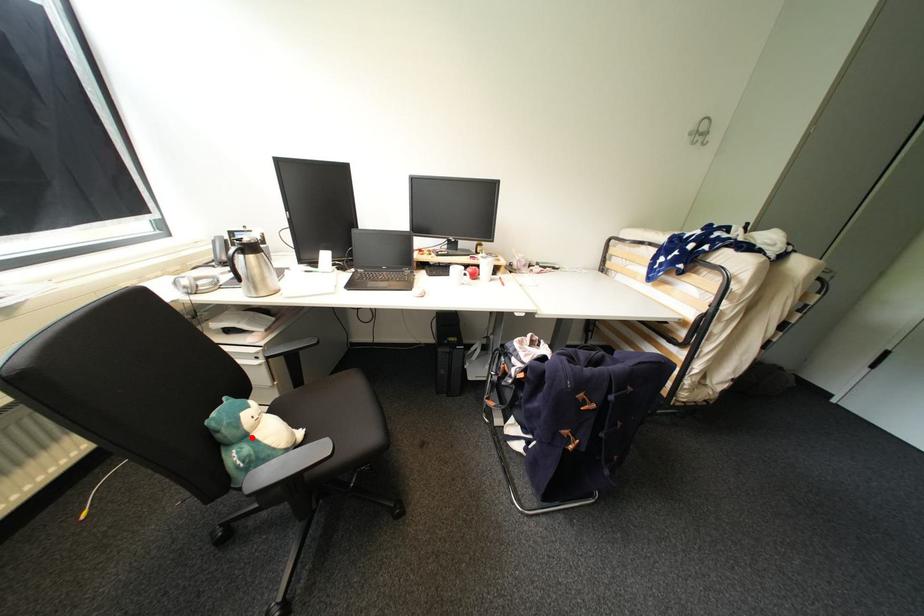
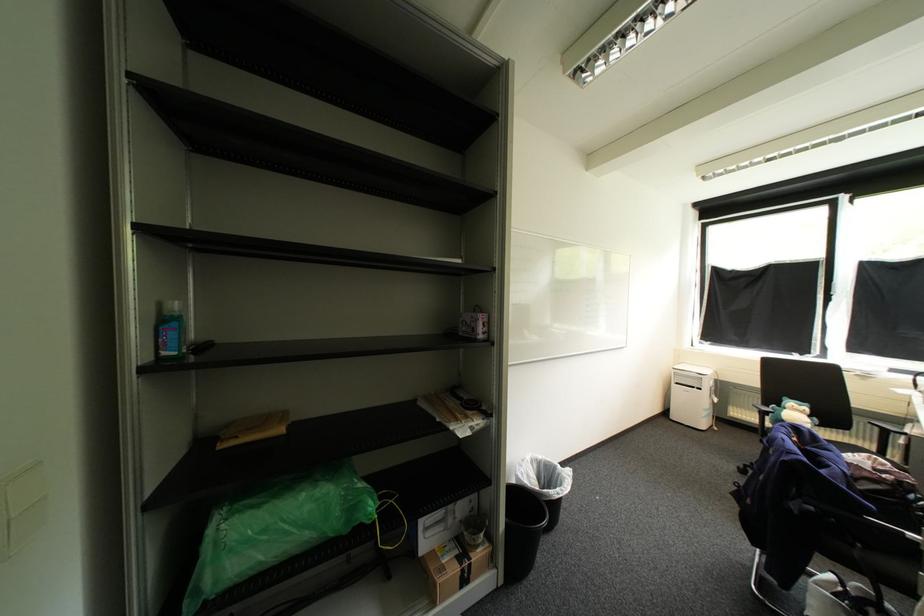
Question: I am providing you with two images of the same scene from different viewpoints. A red point is marked on the first image. At the location where the point appears in image 1, is it still visible in image 2?

Choices:
 (A) Yes
 (B) No

Answer: (A)